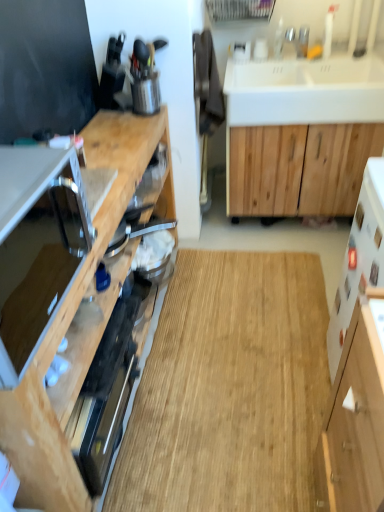
What is the approximate height of wooden cabinet at left, acting as the 3th cabinetry starting from the right?

wooden cabinet at left, acting as the 3th cabinetry starting from the right, is 31.73 inches tall.

Locate an element on the screen. The width and height of the screenshot is (384, 512). wooden cabinet at left, acting as the 3th cabinetry starting from the right is located at coordinates (64, 289).

Measure the distance between natural wood cabinet at center, the 3th cabinetry from the left, and camera.

natural wood cabinet at center, the 3th cabinetry from the left, is 6.76 feet from camera.

Image resolution: width=384 pixels, height=512 pixels. What do you see at coordinates (300, 168) in the screenshot?
I see `natural wood cabinet at center, the 3th cabinetry from the left` at bounding box center [300, 168].

The height and width of the screenshot is (512, 384). Describe the element at coordinates (355, 418) in the screenshot. I see `white matte cabinet at lower right, which is counted as the second cabinetry, starting from the right` at that location.

Identify the location of satin silver microwave at left, marked as the first appliance in a bottom-to-top arrangement. The image size is (384, 512). (37, 248).

The image size is (384, 512). I want to click on white glossy sink at upper right, so click(x=305, y=91).

This screenshot has height=512, width=384. I want to click on metallic silver utensil holder at upper left, positioned as the second appliance in front-to-back order, so click(146, 94).

The width and height of the screenshot is (384, 512). I want to click on wooden cabinet at left, acting as the 3th cabinetry starting from the right, so click(x=64, y=289).

Considering the relative positions of natural wood floor at center and silver metallic faucet at upper right in the image provided, is natural wood floor at center to the right of silver metallic faucet at upper right from the viewer's perspective?

In fact, natural wood floor at center is to the left of silver metallic faucet at upper right.

I want to click on faucet that is behind the natural wood floor at center, so click(x=298, y=39).

From a real-world perspective, who is located lower, natural wood floor at center or silver metallic faucet at upper right?

natural wood floor at center, from a real-world perspective.

Considering the relative sizes of natural wood floor at center and silver metallic faucet at upper right in the image provided, is natural wood floor at center wider than silver metallic faucet at upper right?

Indeed, natural wood floor at center has a greater width compared to silver metallic faucet at upper right.

Consider the image. Which is farther from the camera, (x=239, y=134) or (x=178, y=280)?

Positioned behind is point (x=178, y=280).

Measure the distance from natural wood cabinet at center, the 3th cabinetry from the left, to natural wood floor at center.

natural wood cabinet at center, the 3th cabinetry from the left, and natural wood floor at center are 32.91 inches apart from each other.

Does natural wood cabinet at center, the 3th cabinetry from the left, have a smaller size compared to natural wood floor at center?

No, natural wood cabinet at center, the 3th cabinetry from the left, is not smaller than natural wood floor at center.

Does natural wood cabinet at center, acting as the 1th cabinetry starting from the right, appear on the left side of natural wood floor at center?

Incorrect, natural wood cabinet at center, acting as the 1th cabinetry starting from the right, is not on the left side of natural wood floor at center.

From the image's perspective, between natural wood floor at center and metallic silver utensil holder at upper left, positioned as the second appliance in front-to-back order, who is located below?

natural wood floor at center.

Considering the sizes of natural wood floor at center and metallic silver utensil holder at upper left, which appears as the 1th appliance when viewed from the top, in the image, is natural wood floor at center bigger or smaller than metallic silver utensil holder at upper left, which appears as the 1th appliance when viewed from the top,?

Considering their sizes, natural wood floor at center takes up more space than metallic silver utensil holder at upper left, which appears as the 1th appliance when viewed from the top.

Consider the image. Is natural wood floor at center shorter than metallic silver utensil holder at upper left, which appears as the 1th appliance when viewed from the top?

Indeed, natural wood floor at center has a lesser height compared to metallic silver utensil holder at upper left, which appears as the 1th appliance when viewed from the top.

Does natural wood cabinet at center, the 3th cabinetry from the left, have a smaller size compared to white matte cabinet at lower right, which is counted as the second cabinetry, starting from the right?

Actually, natural wood cabinet at center, the 3th cabinetry from the left, might be larger than white matte cabinet at lower right, which is counted as the second cabinetry, starting from the right.

From the image's perspective, is natural wood cabinet at center, the 3th cabinetry from the left, positioned above or below white matte cabinet at lower right, the 2th cabinetry from the left?

natural wood cabinet at center, the 3th cabinetry from the left, is above white matte cabinet at lower right, the 2th cabinetry from the left.

Is natural wood cabinet at center, the 3th cabinetry from the left, next to white matte cabinet at lower right, the 2th cabinetry from the left, and touching it?

No, natural wood cabinet at center, the 3th cabinetry from the left, is not in contact with white matte cabinet at lower right, the 2th cabinetry from the left.

Can you confirm if natural wood cabinet at center, acting as the 1th cabinetry starting from the right, is wider than white matte cabinet at lower right, which is counted as the second cabinetry, starting from the right?

Indeed, natural wood cabinet at center, acting as the 1th cabinetry starting from the right, has a greater width compared to white matte cabinet at lower right, which is counted as the second cabinetry, starting from the right.

In terms of height, does silver metallic faucet at upper right look taller or shorter compared to white glossy sink at upper right?

silver metallic faucet at upper right is shorter than white glossy sink at upper right.

Do you think silver metallic faucet at upper right is within white glossy sink at upper right, or outside of it?

silver metallic faucet at upper right exists outside the volume of white glossy sink at upper right.

Is silver metallic faucet at upper right positioned far away from white glossy sink at upper right?

silver metallic faucet at upper right is near white glossy sink at upper right, not far away.

From the image's perspective, which object appears higher, silver metallic faucet at upper right or white glossy sink at upper right?

silver metallic faucet at upper right appears higher in the image.

Considering the sizes of objects white matte cabinet at lower right, which is counted as the second cabinetry, starting from the right, and white glossy sink at upper right in the image provided, who is smaller, white matte cabinet at lower right, which is counted as the second cabinetry, starting from the right, or white glossy sink at upper right?

white matte cabinet at lower right, which is counted as the second cabinetry, starting from the right.

Is white matte cabinet at lower right, the 2th cabinetry from the left, oriented towards white glossy sink at upper right?

No, white matte cabinet at lower right, the 2th cabinetry from the left, is not aimed at white glossy sink at upper right.

The height and width of the screenshot is (512, 384). Identify the location of sink behind the white matte cabinet at lower right, which is counted as the second cabinetry, starting from the right. (305, 91).

Considering the relative sizes of white matte cabinet at lower right, the 2th cabinetry from the left, and white glossy sink at upper right in the image provided, is white matte cabinet at lower right, the 2th cabinetry from the left, shorter than white glossy sink at upper right?

No.

From the image's perspective, is natural wood cabinet at center, the 3th cabinetry from the left, below silver metallic faucet at upper right?

Indeed, from the image's perspective, natural wood cabinet at center, the 3th cabinetry from the left, is shown beneath silver metallic faucet at upper right.

Consider the image. Is natural wood cabinet at center, acting as the 1th cabinetry starting from the right, outside of silver metallic faucet at upper right?

Absolutely, natural wood cabinet at center, acting as the 1th cabinetry starting from the right, is external to silver metallic faucet at upper right.

Is natural wood cabinet at center, the 3th cabinetry from the left, wider than silver metallic faucet at upper right?

Indeed, natural wood cabinet at center, the 3th cabinetry from the left, has a greater width compared to silver metallic faucet at upper right.

Are natural wood cabinet at center, the 3th cabinetry from the left, and silver metallic faucet at upper right far apart?

natural wood cabinet at center, the 3th cabinetry from the left, is near silver metallic faucet at upper right, not far away.

Where is `faucet above the natural wood floor at center (from the image's perspective)`? faucet above the natural wood floor at center (from the image's perspective) is located at coordinates (298, 39).

This screenshot has width=384, height=512. Find the location of `hardwood below the natural wood cabinet at center, acting as the 1th cabinetry starting from the right (from the image's perspective)`. hardwood below the natural wood cabinet at center, acting as the 1th cabinetry starting from the right (from the image's perspective) is located at coordinates (229, 389).

Which object lies further to the anchor point white glossy sink at upper right, silver metallic faucet at upper right or natural wood cabinet at center, the 3th cabinetry from the left?

The object further to white glossy sink at upper right is natural wood cabinet at center, the 3th cabinetry from the left.

When comparing their distances from white matte cabinet at lower right, which is counted as the second cabinetry, starting from the right, does natural wood cabinet at center, the 3th cabinetry from the left, or satin silver microwave at left, marked as the first appliance in a bottom-to-top arrangement, seem closer?

satin silver microwave at left, marked as the first appliance in a bottom-to-top arrangement, lies closer to white matte cabinet at lower right, which is counted as the second cabinetry, starting from the right, than the other object.

From the image, which object appears to be nearer to silver metallic faucet at upper right, satin silver microwave at left, arranged as the first appliance when viewed from the front, or metallic silver utensil holder at upper left, which appears as the 1th appliance when viewed from the top?

metallic silver utensil holder at upper left, which appears as the 1th appliance when viewed from the top, is closer to silver metallic faucet at upper right.

Looking at the image, which one is located closer to white matte cabinet at lower right, which is counted as the second cabinetry, starting from the right, wooden cabinet at left, acting as the 3th cabinetry starting from the right, or silver metallic faucet at upper right?

Among the two, wooden cabinet at left, acting as the 3th cabinetry starting from the right, is located nearer to white matte cabinet at lower right, which is counted as the second cabinetry, starting from the right.

Based on their spatial positions, is satin silver microwave at left, the 2th appliance positioned from the back, or metallic silver utensil holder at upper left, which appears as the 1th appliance when viewed from the top, closer to natural wood cabinet at center, acting as the 1th cabinetry starting from the right?

metallic silver utensil holder at upper left, which appears as the 1th appliance when viewed from the top, is positioned closer to the anchor natural wood cabinet at center, acting as the 1th cabinetry starting from the right.

From the image, which object appears to be nearer to wooden cabinet at left, acting as the 3th cabinetry starting from the right, satin silver microwave at left, the 2th appliance positioned from the back, or white glossy sink at upper right?

Based on the image, satin silver microwave at left, the 2th appliance positioned from the back, appears to be nearer to wooden cabinet at left, acting as the 3th cabinetry starting from the right.

Looking at the image, which one is located closer to silver metallic faucet at upper right, satin silver microwave at left, marked as the first appliance in a bottom-to-top arrangement, or white glossy sink at upper right?

white glossy sink at upper right is positioned closer to the anchor silver metallic faucet at upper right.

When comparing their distances from silver metallic faucet at upper right, does wooden cabinet at left, the 1th cabinetry viewed from the left, or natural wood cabinet at center, the 3th cabinetry from the left, seem further?

wooden cabinet at left, the 1th cabinetry viewed from the left, is further to silver metallic faucet at upper right.

Locate an element on the screen. appliance between wooden cabinet at left, the 1th cabinetry viewed from the left, and natural wood cabinet at center, acting as the 1th cabinetry starting from the right, in the front-back direction is located at coordinates (146, 94).

The image size is (384, 512). Find the location of `sink between metallic silver utensil holder at upper left, which appears as the 1th appliance when viewed from the top, and natural wood cabinet at center, acting as the 1th cabinetry starting from the right, from left to right`. sink between metallic silver utensil holder at upper left, which appears as the 1th appliance when viewed from the top, and natural wood cabinet at center, acting as the 1th cabinetry starting from the right, from left to right is located at coordinates (305, 91).

Locate an element on the screen. sink between satin silver microwave at left, which ranks as the second appliance in top-to-bottom order, and silver metallic faucet at upper right from front to back is located at coordinates (305, 91).

Locate an element on the screen. Image resolution: width=384 pixels, height=512 pixels. faucet located between metallic silver utensil holder at upper left, which is counted as the second appliance, starting from the bottom, and natural wood cabinet at center, the 3th cabinetry from the left, in the left-right direction is located at coordinates (298, 39).